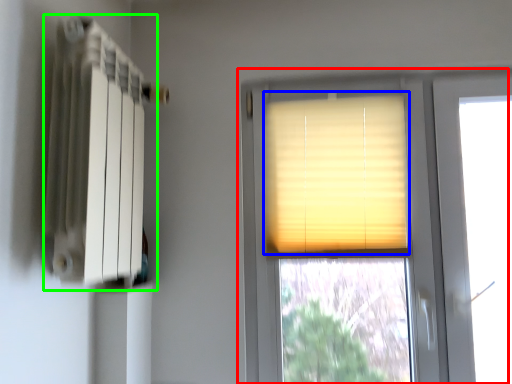
Question: Based on their relative distances, which object is farther from window (highlighted by a red box)? Choose from window blind (highlighted by a blue box) and radiator (highlighted by a green box).

Choices:
 (A) window blind
 (B) radiator

Answer: (B)